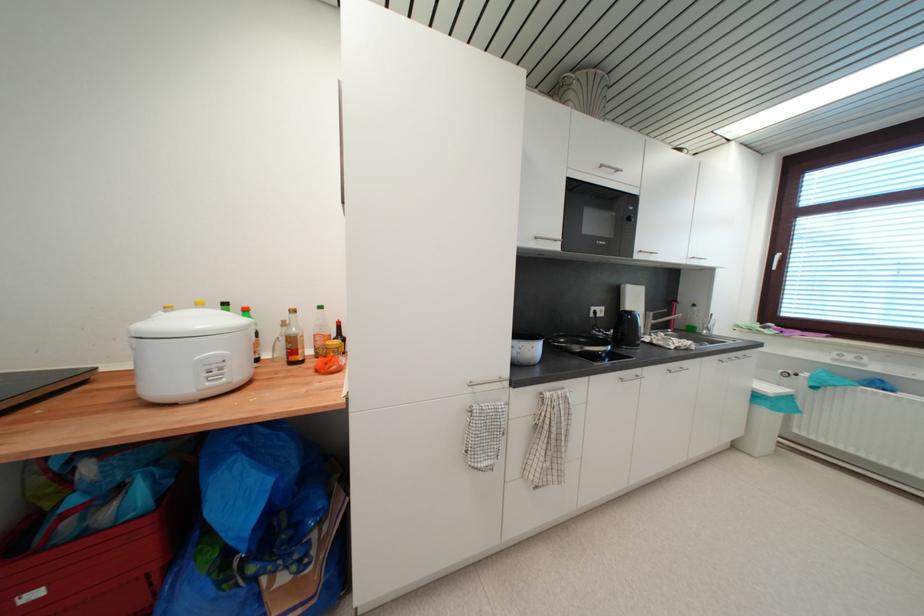
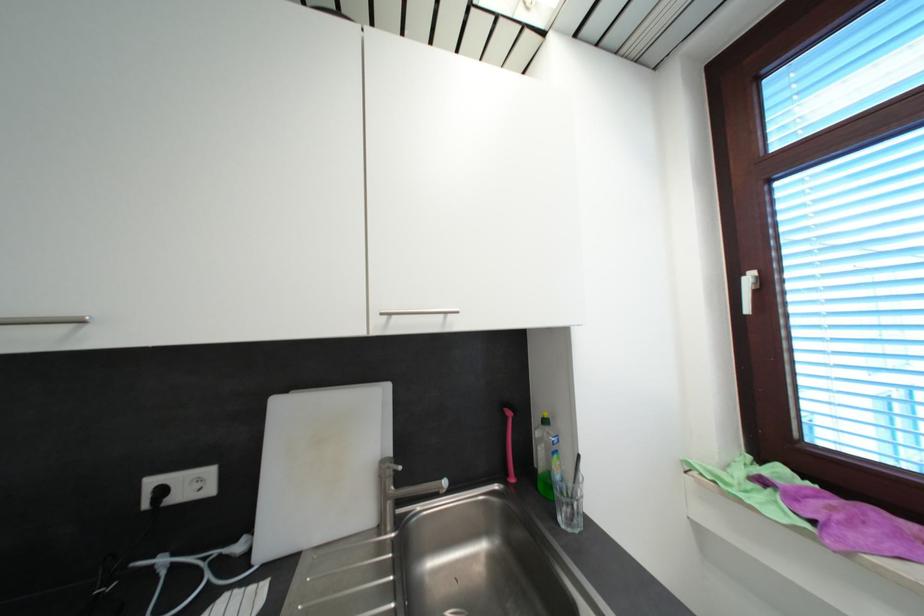
In the second image, find the point that corresponds to [783,259] in the first image.

(754, 281)